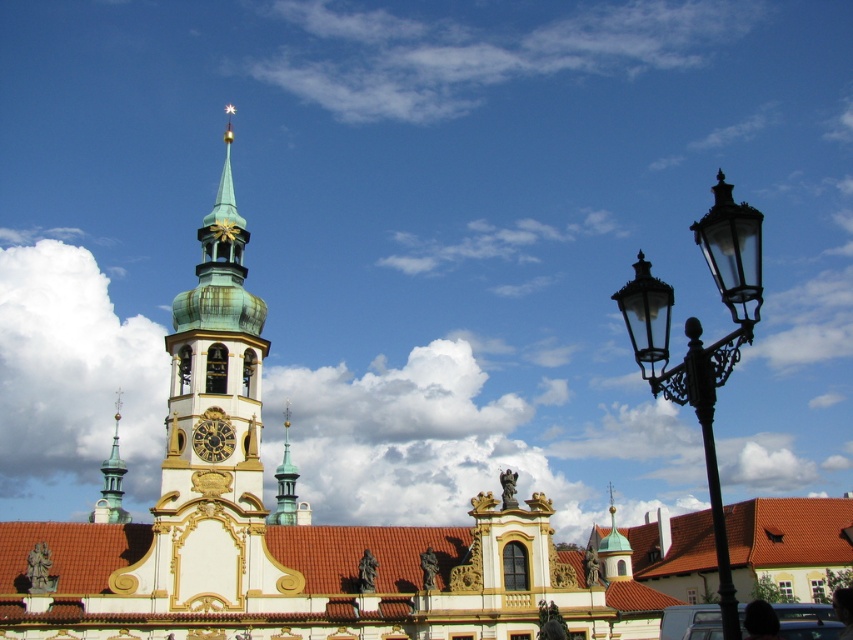
Question: Is green copper tower at center smaller than green stone spire at upper left?

Choices:
 (A) no
 (B) yes

Answer: (A)

Question: Which point is farther from the camera taking this photo?

Choices:
 (A) (115, 499)
 (B) (740, 323)
 (C) (280, 518)

Answer: (A)

Question: Which object is the farthest from the gold textured dome at center?

Choices:
 (A) gold ornate church at center
 (B) gold/brass/decorativeclock at center
 (C) black glass street light at right
 (D) green polished stone spire at center

Answer: (D)

Question: Does green copper tower at center have a smaller size compared to black glass street light at right?

Choices:
 (A) yes
 (B) no

Answer: (A)

Question: Among these points, which one is farthest from the camera?

Choices:
 (A) (625, 579)
 (B) (230, 268)
 (C) (107, 472)
 (D) (608, 580)

Answer: (C)

Question: Does black glass street light at right have a greater width compared to gold textured dome at center?

Choices:
 (A) no
 (B) yes

Answer: (B)